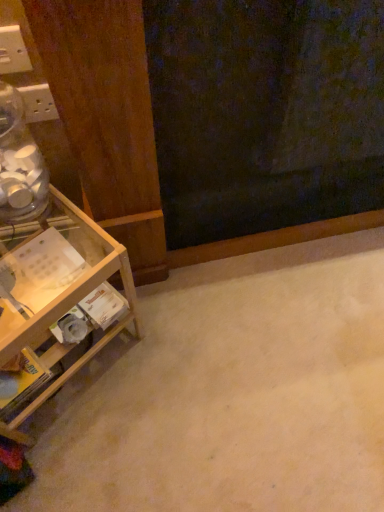
Question: Considering the positions of white plastic electric outlet at upper left, the 1th electric outlet in the front-to-back sequence, and white plastic electric outlet at upper left, the 1th electric outlet viewed from the back, in the image, is white plastic electric outlet at upper left, the 1th electric outlet in the front-to-back sequence, wider or thinner than white plastic electric outlet at upper left, the 1th electric outlet viewed from the back,?

Choices:
 (A) thin
 (B) wide

Answer: (A)

Question: Considering their positions, is white plastic electric outlet at upper left, marked as the second electric outlet in a back-to-front arrangement, located in front of or behind white plastic electric outlet at upper left, acting as the 2th electric outlet starting from the top?

Choices:
 (A) behind
 (B) front

Answer: (B)

Question: Which object is the farthest from the white plastic electric outlet at upper left, the 2th electric outlet when ordered from front to back?

Choices:
 (A) white plastic electric outlet at upper left, which ranks as the second electric outlet in bottom-to-top order
 (B) wooden shelf at left

Answer: (B)

Question: Estimate the real-world distances between objects in this image. Which object is farther from the white plastic electric outlet at upper left, the 2th electric outlet when ordered from front to back?

Choices:
 (A) wooden shelf at left
 (B) white plastic electric outlet at upper left, marked as the second electric outlet in a back-to-front arrangement

Answer: (A)